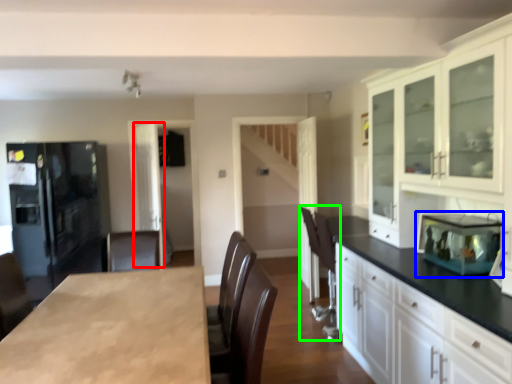
Question: Considering the real-world distances, which object is closest to glass door (highlighted by a red box)? appliance (highlighted by a blue box) or armchair (highlighted by a green box).

Choices:
 (A) appliance
 (B) armchair

Answer: (B)